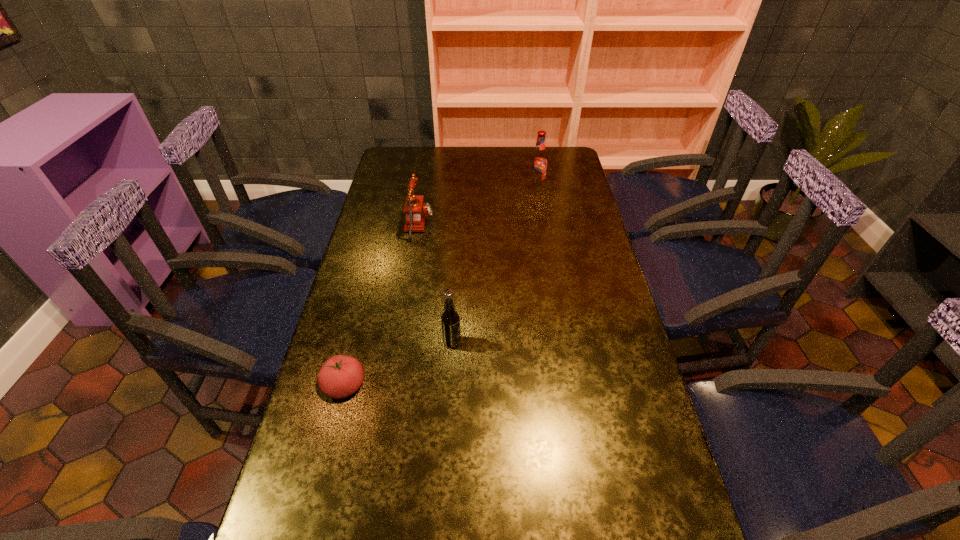
I want to click on the rightmost object, so click(538, 166).

Identify the location of the taller root beer. This screenshot has height=540, width=960. (538, 166).

Locate an element on the screen. the shorter root beer is located at coordinates (450, 320).

Find the location of `the third shortest object`. the third shortest object is located at coordinates (450, 320).

Where is `telephone`? telephone is located at coordinates (416, 211).

Identify the location of the second farthest object. Image resolution: width=960 pixels, height=540 pixels. (416, 211).

Where is `tomato`? The width and height of the screenshot is (960, 540). tomato is located at coordinates (341, 376).

Where is `the leftmost object`? the leftmost object is located at coordinates (341, 376).

Where is `free region located 0.090m on the front of the tallest object`? This screenshot has width=960, height=540. free region located 0.090m on the front of the tallest object is located at coordinates (540, 204).

Find the location of a particular element. The height and width of the screenshot is (540, 960). free spot located 0.100m on the label of the nearer root beer is located at coordinates (497, 342).